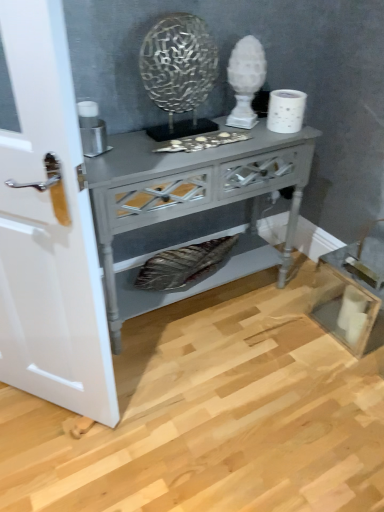
The width and height of the screenshot is (384, 512). I want to click on white glossy door at left, so click(x=49, y=228).

What do you see at coordinates (92, 129) in the screenshot?
I see `metallic silver candle holder at left` at bounding box center [92, 129].

Measure the distance between point [89,120] and camera.

The depth of point [89,120] is 1.30 meters.

Identify the location of white textured toilet paper at upper right. (286, 111).

From the image's perspective, is white textured toilet paper at upper right located above or below metallic silver candle holder at left?

Based on their image positions, white textured toilet paper at upper right is located above metallic silver candle holder at left.

Is white textured toilet paper at upper right looking in the opposite direction of metallic silver candle holder at left?

No.

Considering the sizes of objects white textured toilet paper at upper right and metallic silver candle holder at left in the image provided, who is smaller, white textured toilet paper at upper right or metallic silver candle holder at left?

metallic silver candle holder at left.

Which is correct: white textured toilet paper at upper right is inside metallic silver candle holder at left, or outside of it?

The correct answer is: outside.

Where is `toilet paper above the white glossy door at left (from a real-world perspective)`? This screenshot has height=512, width=384. toilet paper above the white glossy door at left (from a real-world perspective) is located at coordinates (286, 111).

Does white textured toilet paper at upper right appear on the right side of white glossy door at left?

Yes, white textured toilet paper at upper right is to the right of white glossy door at left.

Is white textured toilet paper at upper right smaller than white glossy door at left?

Indeed, white textured toilet paper at upper right has a smaller size compared to white glossy door at left.

Who is smaller, matte gray wooden nightstand at center or white textured toilet paper at upper right?

With smaller size is white textured toilet paper at upper right.

Based on the photo, from the image's perspective, is matte gray wooden nightstand at center above white textured toilet paper at upper right?

No.

In the image, is matte gray wooden nightstand at center on the left side or the right side of white textured toilet paper at upper right?

From the image, it's evident that matte gray wooden nightstand at center is to the left of white textured toilet paper at upper right.

Based on the photo, can you confirm if matte gray wooden nightstand at center is wider than metallic silver candle holder at left?

Correct, the width of matte gray wooden nightstand at center exceeds that of metallic silver candle holder at left.

Based on the photo, how much distance is there between matte gray wooden nightstand at center and metallic silver candle holder at left?

matte gray wooden nightstand at center and metallic silver candle holder at left are 14.53 inches apart from each other.

Can we say matte gray wooden nightstand at center lies outside metallic silver candle holder at left?

Indeed, matte gray wooden nightstand at center is completely outside metallic silver candle holder at left.

Between point (150, 150) and point (92, 118), which one is positioned behind?

The point (150, 150) is farther from the camera.

Measure the distance from metallic silver candle holder at left to white glossy door at left.

The distance of metallic silver candle holder at left from white glossy door at left is 20.66 inches.

Who is taller, metallic silver candle holder at left or white glossy door at left?

white glossy door at left.

From the picture: From the image's perspective, is metallic silver candle holder at left beneath white glossy door at left?

Answer: No.

Is metallic silver candle holder at left closer to the viewer compared to white glossy door at left?

No, metallic silver candle holder at left is further to the viewer.

From the picture: From the image's perspective, is white glossy door at left on white textured toilet paper at upper right?

No.

Is the surface of white glossy door at left in direct contact with white textured toilet paper at upper right?

They are not placed beside each other.

Is white textured toilet paper at upper right completely or partially inside white glossy door at left?

No, white textured toilet paper at upper right is not inside white glossy door at left.

What's the angular difference between white glossy door at left and matte gray wooden nightstand at center's facing directions?

The facing directions of white glossy door at left and matte gray wooden nightstand at center are 54.1 degrees apart.

Identify the location of nightstand on the right side of white glossy door at left. (189, 190).

Which of these two, white glossy door at left or matte gray wooden nightstand at center, is bigger?

matte gray wooden nightstand at center.

Is white glossy door at left positioned far away from matte gray wooden nightstand at center?

No, white glossy door at left is not far from matte gray wooden nightstand at center.

Identify the location of toilet paper beneath the metallic silver candle holder at left (from a real-world perspective). This screenshot has height=512, width=384. (x=286, y=111).

What are the coordinates of `toilet paper to the right of white glossy door at left` in the screenshot? It's located at (286, 111).

Based on their spatial positions, is white textured toilet paper at upper right or matte gray wooden nightstand at center further from metallic silver candle holder at left?

white textured toilet paper at upper right.

Based on their spatial positions, is white glossy door at left or white textured toilet paper at upper right closer to metallic silver candle holder at left?

Based on the image, white glossy door at left appears to be nearer to metallic silver candle holder at left.

When comparing their distances from metallic silver candle holder at left, does white textured toilet paper at upper right or white glossy door at left seem further?

white textured toilet paper at upper right is further to metallic silver candle holder at left.

From the image, which object appears to be nearer to white glossy door at left, metallic silver candle holder at left or matte gray wooden nightstand at center?

matte gray wooden nightstand at center lies closer to white glossy door at left than the other object.

Based on their spatial positions, is white glossy door at left or metallic silver candle holder at left closer to white textured toilet paper at upper right?

metallic silver candle holder at left is closer to white textured toilet paper at upper right.

Considering their positions, is matte gray wooden nightstand at center positioned closer to metallic silver candle holder at left than white glossy door at left?

matte gray wooden nightstand at center.

Based on their spatial positions, is matte gray wooden nightstand at center or metallic silver candle holder at left closer to white glossy door at left?

The object closer to white glossy door at left is matte gray wooden nightstand at center.

Based on their spatial positions, is matte gray wooden nightstand at center or white glossy door at left further from white textured toilet paper at upper right?

white glossy door at left is positioned further to the anchor white textured toilet paper at upper right.

Identify the location of nightstand between white glossy door at left and white textured toilet paper at upper right from front to back. This screenshot has width=384, height=512. (189, 190).

Identify the location of nightstand situated between metallic silver candle holder at left and white textured toilet paper at upper right from left to right. The image size is (384, 512). (189, 190).

Find the location of a particular element. appliance between white glossy door at left and white textured toilet paper at upper right in the horizontal direction is located at coordinates (92, 129).

Identify the location of nightstand positioned between white glossy door at left and metallic silver candle holder at left from near to far. click(189, 190).